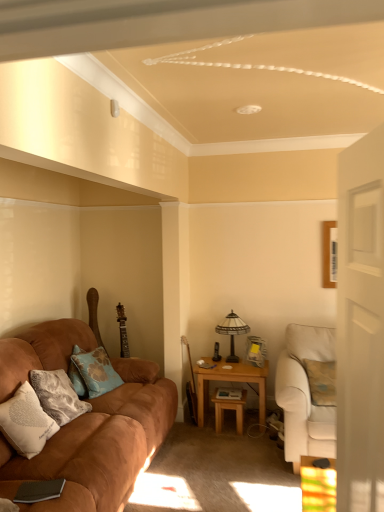
In order to click on unoccupied area in front of wooden table at center, acting as the 2th table starting from the right in this screenshot , I will do `click(243, 440)`.